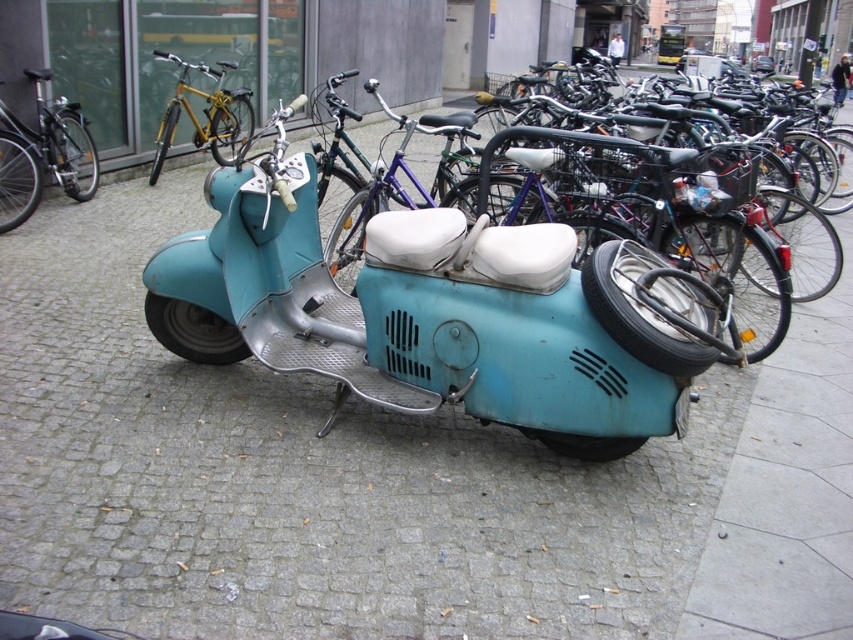
Can you confirm if matte blue scooter at center is taller than gold metallic bicycle at upper left?

Correct, matte blue scooter at center is much taller as gold metallic bicycle at upper left.

Which of these two, matte blue scooter at center or gold metallic bicycle at upper left, stands shorter?

Standing shorter between the two is gold metallic bicycle at upper left.

Who is more forward, (740, 221) or (180, 68)?

Point (740, 221) is more forward.

Locate an element on the screen. Image resolution: width=853 pixels, height=640 pixels. matte blue scooter at center is located at coordinates (670, 212).

Does shiny silver bicycle at left appear under gold metallic bicycle at upper left?

Indeed, shiny silver bicycle at left is positioned under gold metallic bicycle at upper left.

Is point (71, 186) behind point (241, 145)?

No, it is in front of (241, 145).

Which is in front, point (36, 84) or point (160, 129)?

Point (36, 84) is more forward.

Where is `shiny silver bicycle at left`? shiny silver bicycle at left is located at coordinates (44, 156).

Which is in front, point (733, 218) or point (96, 188)?

Point (733, 218) is more forward.

Does point (666, 150) come closer to viewer compared to point (73, 164)?

Yes.

At what (x,y) coordinates should I click in order to perform the action: click on matte blue scooter at center. Please return your answer as a coordinate pair (x, y). The width and height of the screenshot is (853, 640). Looking at the image, I should click on (670, 212).